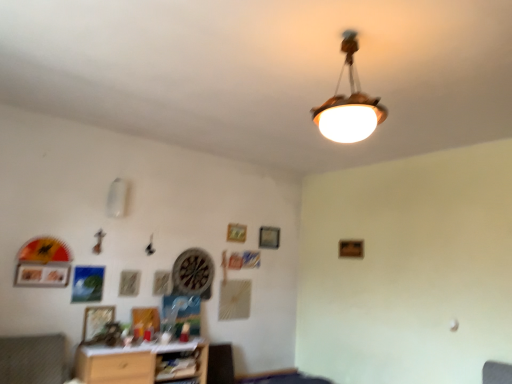
Question: From a real-world perspective, is wooden dartboard at center positioned above or below matte silver picture frame at lower left, positioned as the 1th picture frame in left-to-right order?

Choices:
 (A) below
 (B) above

Answer: (B)

Question: Would you say wooden dartboard at center is to the left or to the right of matte silver picture frame at lower left, which is the 2th picture frame in top-to-bottom order, in the picture?

Choices:
 (A) left
 (B) right

Answer: (B)

Question: Considering the real-world distances, which object is closest to the wooden shelf at lower center?

Choices:
 (A) matte silver picture frame at lower left, positioned as the 1th picture frame in left-to-right order
 (B) wooden dartboard at center
 (C) textured fabric swivel chair at lower left
 (D) wooden table at lower center
 (E) wooden picture frame at upper center, arranged as the first picture frame when viewed from the back

Answer: (D)

Question: Based on their relative distances, which object is nearer to the wooden picture frame at lower left, the third picture frame when ordered from top to bottom?

Choices:
 (A) matte silver picture frame at lower left, which ranks as the 3th picture frame in back-to-front order
 (B) wooden dartboard at center
 (C) wooden ceiling light at upper center
 (D) wooden shelf at lower center
 (E) wooden picture frame at upper center, marked as the 3th picture frame in a front-to-back arrangement

Answer: (A)